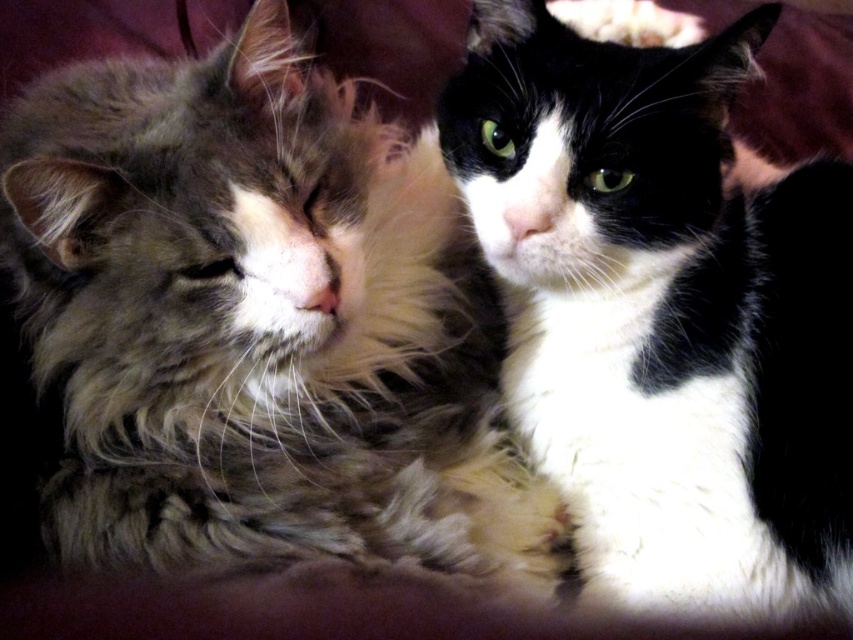
Looking at this image, between fluffy fur cat at center and black and white fur cat at center, which one is positioned higher?

black and white fur cat at center is higher up.

Based on the photo, can you confirm if fluffy fur cat at center is wider than black and white fur cat at center?

Yes.

Locate an element on the screen. This screenshot has height=640, width=853. fluffy fur cat at center is located at coordinates (x=257, y=321).

Where is `fluffy fur cat at center`? This screenshot has height=640, width=853. fluffy fur cat at center is located at coordinates pyautogui.click(x=257, y=321).